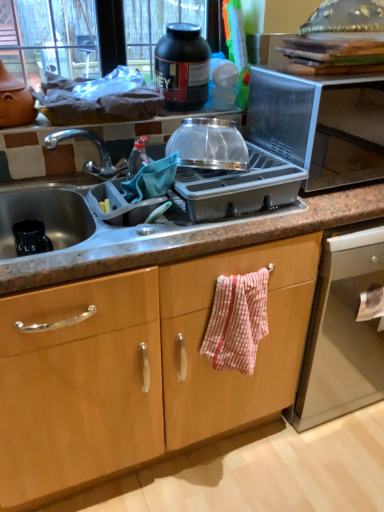
Question: From a real-world perspective, is transparent plastic bowl at upper center, the first kitchen appliance ordered from the bottom, physically located above or below red and white checkered fabric at center?

Choices:
 (A) above
 (B) below

Answer: (A)

Question: From the image's perspective, relative to red and white checkered fabric at center, is transparent plastic bowl at upper center, the first kitchen appliance ordered from the bottom, above or below?

Choices:
 (A) above
 (B) below

Answer: (A)

Question: Estimate the real-world distances between objects in this image. Which object is farther from the transparent plastic bowl at upper center, which is the first kitchen appliance from front to back?

Choices:
 (A) granite gray sink at center
 (B) black plastic jar at upper center, which ranks as the second kitchen appliance in front-to-back order
 (C) transparent plastic microwave at upper right
 (D) red and white checkered fabric at center

Answer: (D)

Question: Which of these objects is positioned closest to the granite gray sink at center?

Choices:
 (A) transparent plastic microwave at upper right
 (B) black plastic jar at upper center, which ranks as the second kitchen appliance in front-to-back order
 (C) transparent plastic bowl at upper center, arranged as the 2th kitchen appliance when viewed from the top
 (D) red and white checkered fabric at center

Answer: (D)